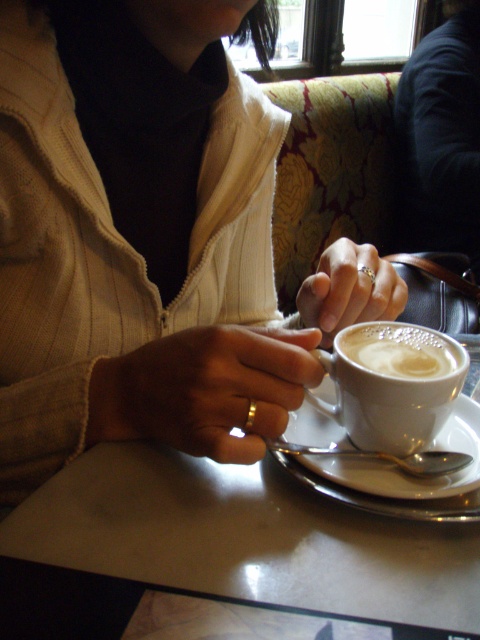
Who is taller, white matte cup at center or white frothy coffee at center?

With more height is white matte cup at center.

Does white matte cup at center have a greater width compared to white frothy coffee at center?

Yes.

Does point (372, 349) come closer to viewer compared to point (453, 358)?

No.

Identify the location of white matte cup at center. The height and width of the screenshot is (640, 480). (393, 385).

Does point (57, 404) come closer to viewer compared to point (454, 506)?

No, it is behind (454, 506).

Consider the image. Who is positioned more to the right, matte white cup at center or white glossy table at center?

white glossy table at center is more to the right.

Is point (168, 221) closer to viewer compared to point (454, 596)?

No.

At what (x,y) coordinates should I click in order to perform the action: click on matte white cup at center. Please return your answer as a coordinate pair (x, y). The width and height of the screenshot is (480, 640). Looking at the image, I should click on (148, 240).

Which of these two, white glossy table at center or white matte cup at center, stands taller?

white matte cup at center is taller.

Does white glossy table at center appear over white matte cup at center?

Incorrect, white glossy table at center is not positioned above white matte cup at center.

Between point (282, 467) and point (375, 378), which one is positioned behind?

The point (282, 467) is more distant.

The image size is (480, 640). What are the coordinates of `white glossy table at center` in the screenshot? It's located at (224, 556).